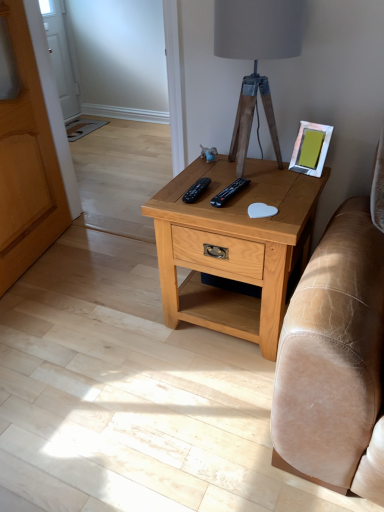
You are a GUI agent. You are given a task and a screenshot of the screen. Output one action in this format:
    pyautogui.click(x=<x>, y=<y>)
    Task: Click on the free point to the right of wooden armoire at left
    
    Given the screenshot: What is the action you would take?
    pyautogui.click(x=101, y=262)